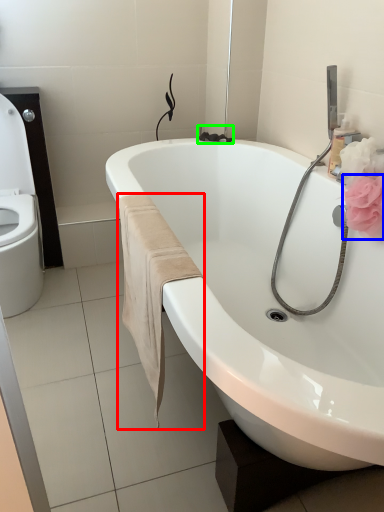
Question: Based on their relative distances, which object is farther from bath towel (highlighted by a red box)? Choose from flower (highlighted by a blue box) and plumbing fixture (highlighted by a green box).

Choices:
 (A) flower
 (B) plumbing fixture

Answer: (B)